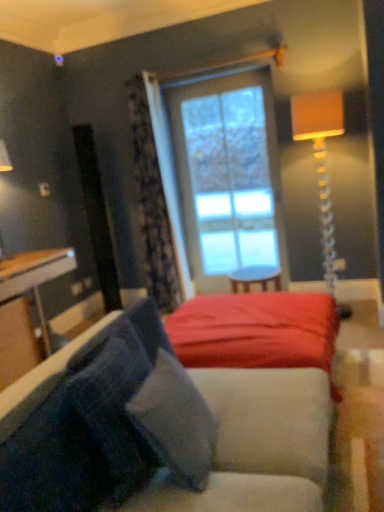
Question: From a real-world perspective, is velvety gray pillow at lower left, which is the second pillow from left to right, over velvety blue pillow at lower left, acting as the first pillow starting from the left?

Choices:
 (A) yes
 (B) no

Answer: (B)

Question: From a real-world perspective, is velvety gray pillow at lower left, which is the second pillow from left to right, below velvety blue pillow at lower left, acting as the first pillow starting from the left?

Choices:
 (A) no
 (B) yes

Answer: (B)

Question: Can you confirm if velvety gray pillow at lower left, the first pillow when ordered from right to left, is bigger than velvety blue pillow at lower left, acting as the first pillow starting from the left?

Choices:
 (A) yes
 (B) no

Answer: (B)

Question: Is velvety blue pillow at lower left, which ranks as the 2th pillow in right-to-left order, at the back of velvety gray pillow at lower left, the first pillow when ordered from right to left?

Choices:
 (A) yes
 (B) no

Answer: (A)

Question: Does velvety gray pillow at lower left, which is the second pillow from left to right, come in front of velvety blue pillow at lower left, which ranks as the 2th pillow in right-to-left order?

Choices:
 (A) no
 (B) yes

Answer: (A)

Question: From a real-world perspective, is velvety gray pillow at lower left, the first pillow when ordered from right to left, above or below orange fabric lampshade at upper right?

Choices:
 (A) below
 (B) above

Answer: (A)

Question: From the image's perspective, is velvety gray pillow at lower left, which is the second pillow from left to right, positioned above or below orange fabric lampshade at upper right?

Choices:
 (A) below
 (B) above

Answer: (A)

Question: Is point (177, 458) closer or farther from the camera than point (304, 116)?

Choices:
 (A) farther
 (B) closer

Answer: (B)

Question: Is velvety gray pillow at lower left, the first pillow when ordered from right to left, to the left or to the right of orange fabric lampshade at upper right in the image?

Choices:
 (A) right
 (B) left

Answer: (B)

Question: Considering their positions, is smooth red fabric bed at center located in front of or behind velvety gray pillow at lower left, the first pillow when ordered from right to left?

Choices:
 (A) behind
 (B) front

Answer: (A)

Question: Considering the positions of smooth red fabric bed at center and velvety gray pillow at lower left, the first pillow when ordered from right to left, in the image, is smooth red fabric bed at center bigger or smaller than velvety gray pillow at lower left, the first pillow when ordered from right to left,?

Choices:
 (A) small
 (B) big

Answer: (B)

Question: Is smooth red fabric bed at center situated inside velvety gray pillow at lower left, the first pillow when ordered from right to left, or outside?

Choices:
 (A) outside
 (B) inside

Answer: (A)

Question: From a real-world perspective, is smooth red fabric bed at center positioned above or below velvety gray pillow at lower left, which is the second pillow from left to right?

Choices:
 (A) below
 (B) above

Answer: (A)

Question: Considering the positions of velvety blue pillow at lower left, which ranks as the 2th pillow in right-to-left order, and clear glass window at center in the image, is velvety blue pillow at lower left, which ranks as the 2th pillow in right-to-left order, bigger or smaller than clear glass window at center?

Choices:
 (A) small
 (B) big

Answer: (A)

Question: In terms of width, does velvety blue pillow at lower left, acting as the first pillow starting from the left, look wider or thinner when compared to clear glass window at center?

Choices:
 (A) wide
 (B) thin

Answer: (A)